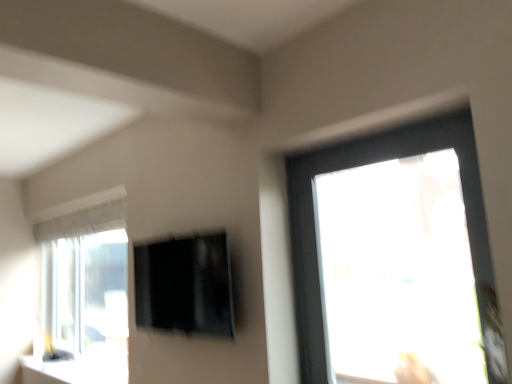
Question: From the image's perspective, is white glossy window sill at lower left under black glossy screen at center?

Choices:
 (A) no
 (B) yes

Answer: (B)

Question: Can you confirm if white glossy window sill at lower left is positioned to the right of black glossy screen at center?

Choices:
 (A) no
 (B) yes

Answer: (A)

Question: Is white glossy window sill at lower left wider than black glossy screen at center?

Choices:
 (A) no
 (B) yes

Answer: (B)

Question: Is white glossy window sill at lower left completely or partially outside of black glossy screen at center?

Choices:
 (A) no
 (B) yes

Answer: (B)

Question: Is the position of white glossy window sill at lower left less distant than that of black glossy screen at center?

Choices:
 (A) no
 (B) yes

Answer: (A)

Question: Is black glossy screen at center inside white glossy window sill at lower left?

Choices:
 (A) yes
 (B) no

Answer: (B)

Question: From the image's perspective, is black glossy screen at center over white glossy window sill at lower left?

Choices:
 (A) yes
 (B) no

Answer: (A)

Question: Is black glossy screen at center positioned in front of white glossy window sill at lower left?

Choices:
 (A) no
 (B) yes

Answer: (B)

Question: Could white glossy window sill at lower left be considered to be inside black glossy screen at center?

Choices:
 (A) yes
 (B) no

Answer: (B)

Question: Considering the relative positions of black glossy screen at center and white glossy window sill at lower left in the image provided, is black glossy screen at center to the left of white glossy window sill at lower left from the viewer's perspective?

Choices:
 (A) no
 (B) yes

Answer: (A)

Question: From the image's perspective, would you say black glossy screen at center is shown under white glossy window sill at lower left?

Choices:
 (A) yes
 (B) no

Answer: (B)

Question: Is the depth of black glossy screen at center greater than that of white glossy window sill at lower left?

Choices:
 (A) yes
 (B) no

Answer: (B)

Question: Is white glossy window sill at lower left inside the boundaries of black glossy screen at center, or outside?

Choices:
 (A) outside
 (B) inside

Answer: (A)